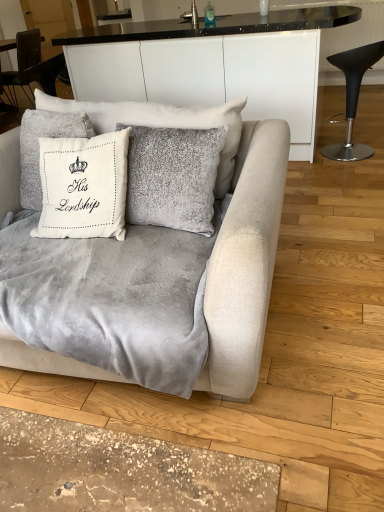
This screenshot has width=384, height=512. Find the location of `velvet gray couch at center`. velvet gray couch at center is located at coordinates (245, 262).

This screenshot has height=512, width=384. Describe the element at coordinates (112, 300) in the screenshot. I see `velvet gray blanket at center` at that location.

This screenshot has width=384, height=512. In order to click on velvet gray couch at center in this screenshot , I will do `click(245, 262)`.

Who is taller, velvet gray couch at center or velvet gray blanket at center?

With more height is velvet gray couch at center.

Where is `sheet below the velvet gray couch at center (from a real-world perspective)`? The height and width of the screenshot is (512, 384). sheet below the velvet gray couch at center (from a real-world perspective) is located at coordinates (112, 300).

Consider the image. Which is more to the left, velvet gray couch at center or velvet gray blanket at center?

velvet gray blanket at center is more to the left.

Between velvet gray couch at center and velvet gray blanket at center, which one has smaller width?

With smaller width is velvet gray blanket at center.

Which of these two, black leather stool at right or velvet gray couch at center, is smaller?

With smaller size is black leather stool at right.

The image size is (384, 512). There is a black leather stool at right. What are the coordinates of `studio couch above it (from a real-world perspective)` in the screenshot? It's located at (245, 262).

Considering the sizes of objects black leather stool at right and velvet gray couch at center in the image provided, who is taller, black leather stool at right or velvet gray couch at center?

velvet gray couch at center.

In the scene shown: Is black leather stool at right in contact with velvet gray couch at center?

No, black leather stool at right is not touching velvet gray couch at center.

Is brushed metal faucet at upper center in front of or behind velvet gray blanket at center in the image?

Clearly, brushed metal faucet at upper center is behind velvet gray blanket at center.

Can we say brushed metal faucet at upper center lies outside velvet gray blanket at center?

Indeed, brushed metal faucet at upper center is completely outside velvet gray blanket at center.

Considering the sizes of objects brushed metal faucet at upper center and velvet gray blanket at center in the image provided, who is smaller, brushed metal faucet at upper center or velvet gray blanket at center?

Smaller between the two is brushed metal faucet at upper center.

Is point (194, 16) closer to camera compared to point (18, 271)?

No, (194, 16) is further to viewer.

Could you tell me if white velvet cushion at upper center, arranged as the first pillow when viewed from the left, is facing black leather stool at right?

No, white velvet cushion at upper center, arranged as the first pillow when viewed from the left, is not aimed at black leather stool at right.

From a real-world perspective, is white velvet cushion at upper center, which ranks as the second pillow in right-to-left order, located higher than black leather stool at right?

Correct, in the physical world, white velvet cushion at upper center, which ranks as the second pillow in right-to-left order, is higher than black leather stool at right.

Between white velvet cushion at upper center, which ranks as the second pillow in right-to-left order, and black leather stool at right, which one has larger width?

With larger width is black leather stool at right.

Considering the positions of objects velvet gray blanket at center and white velvet cushion at center, marked as the 2th pillow in a left-to-right arrangement, in the image provided, who is in front, velvet gray blanket at center or white velvet cushion at center, marked as the 2th pillow in a left-to-right arrangement,?

velvet gray blanket at center.

From the image's perspective, which object appears higher, velvet gray blanket at center or white velvet cushion at center, positioned as the 1th pillow in right-to-left order?

white velvet cushion at center, positioned as the 1th pillow in right-to-left order.

Which of these two, velvet gray blanket at center or white velvet cushion at center, marked as the 2th pillow in a left-to-right arrangement, is wider?

velvet gray blanket at center is wider.

Can you tell me how much white velvet cushion at center, marked as the 2th pillow in a left-to-right arrangement, and black leather stool at right differ in facing direction?

The angular difference between white velvet cushion at center, marked as the 2th pillow in a left-to-right arrangement, and black leather stool at right is 130 degrees.

Considering their positions, is white velvet cushion at center, positioned as the 1th pillow in right-to-left order, located in front of or behind black leather stool at right?

Clearly, white velvet cushion at center, positioned as the 1th pillow in right-to-left order, is in front of black leather stool at right.

Find the location of a particular element. chair behind the white velvet cushion at center, positioned as the 1th pillow in right-to-left order is located at coordinates (353, 98).

Is white velvet cushion at center, marked as the 2th pillow in a left-to-right arrangement, oriented towards black leather stool at right?

No.

From the image's perspective, is white velvet cushion at center, marked as the 2th pillow in a left-to-right arrangement, above velvet gray couch at center?

Yes.

How distant is white velvet cushion at center, marked as the 2th pillow in a left-to-right arrangement, from velvet gray couch at center?

15.56 inches.

From a real-world perspective, is white velvet cushion at center, positioned as the 1th pillow in right-to-left order, beneath velvet gray couch at center?

No, from a real-world perspective, white velvet cushion at center, positioned as the 1th pillow in right-to-left order, is not beneath velvet gray couch at center.

In the scene shown: Relative to velvet gray couch at center, is white velvet cushion at center, marked as the 2th pillow in a left-to-right arrangement, in front or behind?

Answer: white velvet cushion at center, marked as the 2th pillow in a left-to-right arrangement, is positioned farther from the viewer than velvet gray couch at center.

Identify the location of studio couch lying above the velvet gray blanket at center (from the image's perspective). (245, 262).

Locate an element on the screen. studio couch above the black leather stool at right (from a real-world perspective) is located at coordinates (245, 262).

In the scene shown: When comparing their distances from white velvet cushion at upper center, arranged as the first pillow when viewed from the left, does black leather stool at right or velvet gray couch at center seem closer?

The object closer to white velvet cushion at upper center, arranged as the first pillow when viewed from the left, is velvet gray couch at center.

Based on their spatial positions, is velvet gray blanket at center or white velvet cushion at upper center, which ranks as the second pillow in right-to-left order, further from black leather stool at right?

Among the two, velvet gray blanket at center is located further to black leather stool at right.

Which object lies further to the anchor point velvet gray couch at center, white velvet cushion at upper center, which ranks as the second pillow in right-to-left order, or black leather stool at right?

black leather stool at right.

Which object lies nearer to the anchor point white velvet cushion at upper center, arranged as the first pillow when viewed from the left, black leather stool at right or velvet gray blanket at center?

velvet gray blanket at center is positioned closer to the anchor white velvet cushion at upper center, arranged as the first pillow when viewed from the left.

Which object lies nearer to the anchor point white velvet cushion at upper center, arranged as the first pillow when viewed from the left, white velvet cushion at center, marked as the 2th pillow in a left-to-right arrangement, or velvet gray blanket at center?

Among the two, velvet gray blanket at center is located nearer to white velvet cushion at upper center, arranged as the first pillow when viewed from the left.

Based on their spatial positions, is velvet gray blanket at center or black leather stool at right further from velvet gray couch at center?

The object further to velvet gray couch at center is black leather stool at right.

Consider the image. When comparing their distances from velvet gray blanket at center, does black leather stool at right or white velvet cushion at upper center, arranged as the first pillow when viewed from the left, seem closer?

The object closer to velvet gray blanket at center is white velvet cushion at upper center, arranged as the first pillow when viewed from the left.

Looking at the image, which one is located closer to white velvet cushion at center, marked as the 2th pillow in a left-to-right arrangement, brushed metal faucet at upper center or white velvet cushion at upper center, arranged as the first pillow when viewed from the left?

white velvet cushion at upper center, arranged as the first pillow when viewed from the left, is positioned closer to the anchor white velvet cushion at center, marked as the 2th pillow in a left-to-right arrangement.

Where is `chair positioned between velvet gray blanket at center and brushed metal faucet at upper center from near to far`? chair positioned between velvet gray blanket at center and brushed metal faucet at upper center from near to far is located at coordinates (353, 98).

Identify the location of studio couch between white velvet cushion at center, marked as the 2th pillow in a left-to-right arrangement, and velvet gray blanket at center vertically. Image resolution: width=384 pixels, height=512 pixels. (245, 262).

This screenshot has height=512, width=384. In order to click on chair located between velvet gray couch at center and brushed metal faucet at upper center in the depth direction in this screenshot , I will do `click(353, 98)`.

I want to click on chair between white velvet cushion at center, positioned as the 1th pillow in right-to-left order, and brushed metal faucet at upper center, along the z-axis, so click(x=353, y=98).